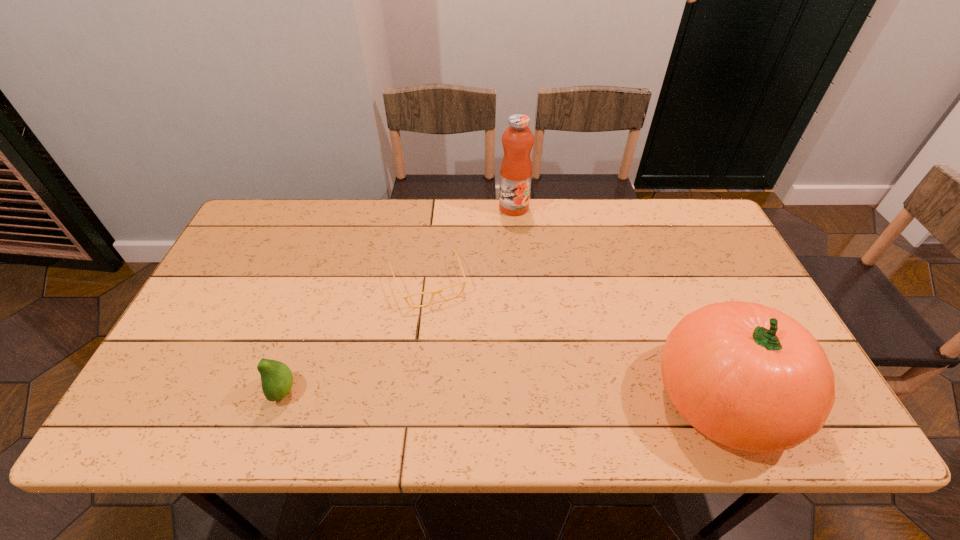
I want to click on unoccupied position between the farthest object and the pumpkin, so click(618, 303).

This screenshot has height=540, width=960. I want to click on blank region between the third shortest object and the third tallest object, so click(504, 394).

What are the coordinates of `vacant space that's between the second farthest object and the third shortest object` in the screenshot? It's located at (576, 340).

Identify the location of vacant area that lies between the leftmost object and the second object from right to left. (399, 299).

What are the coordinates of `vacant space that's between the spectacles and the second shortest object` in the screenshot? It's located at (357, 336).

Image resolution: width=960 pixels, height=540 pixels. Find the location of `empty location between the avocado and the second tallest object`. empty location between the avocado and the second tallest object is located at coordinates (504, 394).

I want to click on free point between the second shortest object and the shortest object, so click(357, 336).

The image size is (960, 540). I want to click on free space between the second tallest object and the second object from right to left, so click(x=618, y=303).

Locate an element on the screen. object identified as the closest to the second object from left to right is located at coordinates (516, 167).

Locate which object is the third closest to the farthest object. Please provide its 2D coordinates. Your answer should be formatted as a tuple, i.e. [(x, y)], where the tuple contains the x and y coordinates of a point satisfying the conditions above.

[(276, 377)]